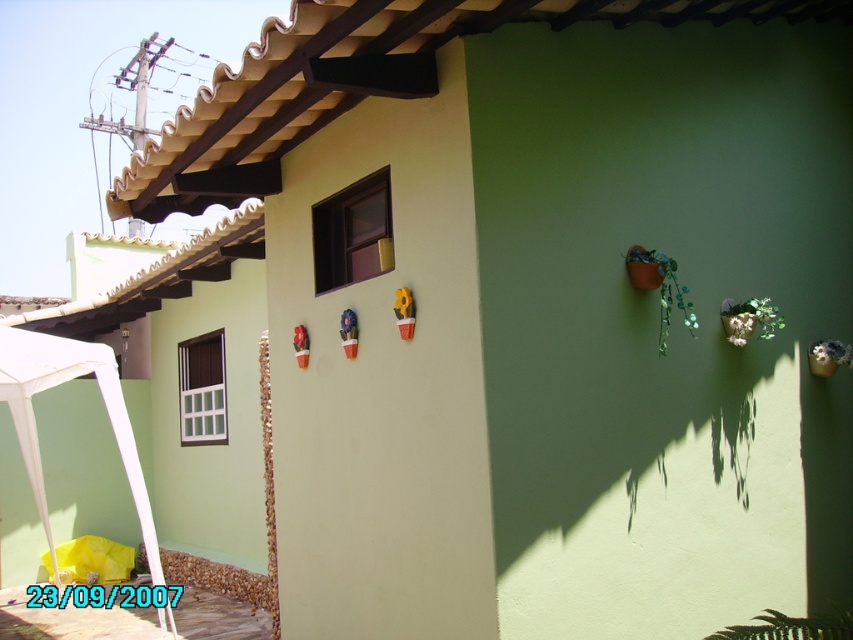
Question: Which point is closer to the camera?

Choices:
 (A) (845, 625)
 (B) (630, 253)

Answer: (A)

Question: Can you confirm if green leafy plant at lower right is positioned above green glossy planter at right?

Choices:
 (A) no
 (B) yes

Answer: (A)

Question: Is green matte plant at upper right closer to the viewer compared to green leafy plant at lower right?

Choices:
 (A) no
 (B) yes

Answer: (A)

Question: Among these objects, which one is farthest from the camera?

Choices:
 (A) green matte plant at upper right
 (B) green leafy plant at lower right
 (C) green glossy planter at right

Answer: (C)

Question: Which of these objects is positioned farthest from the green leafy plant at lower right?

Choices:
 (A) green glossy planter at right
 (B) green matte plant at upper right

Answer: (B)

Question: Does green leafy plant at lower right appear on the right side of green glossy planter at right?

Choices:
 (A) yes
 (B) no

Answer: (B)